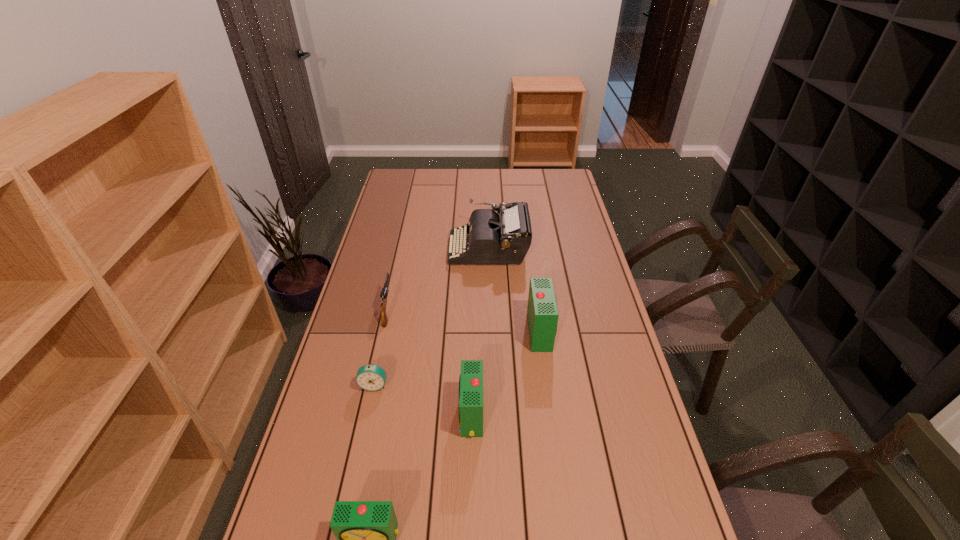
This screenshot has height=540, width=960. I want to click on the third shortest alarm clock, so click(471, 378).

Locate an element on the screen. Image resolution: width=960 pixels, height=540 pixels. the farthest alarm clock is located at coordinates (542, 313).

Find the location of a particular element. the shortest alarm clock is located at coordinates (371, 377).

Identify the location of typewriter. [x=504, y=237].

What are the coordinates of `gun` in the screenshot? It's located at (384, 292).

This screenshot has width=960, height=540. Find the location of `vacant space located 0.290m on the front-facing side of the second alarm clock from right to left`. vacant space located 0.290m on the front-facing side of the second alarm clock from right to left is located at coordinates click(356, 415).

You are a GUI agent. You are given a task and a screenshot of the screen. Output one action in this format:
    pyautogui.click(x=<x>, y=<y>)
    Task: Click on the vacant space located on the front-facing side of the second alarm clock from right to left
    The height and width of the screenshot is (540, 960).
    Given the screenshot: What is the action you would take?
    pyautogui.click(x=443, y=415)

Where is `vacant space located on the front-facing side of the second alarm clock from right to left`? The image size is (960, 540). vacant space located on the front-facing side of the second alarm clock from right to left is located at coordinates (331, 415).

Locate an element on the screen. The width and height of the screenshot is (960, 540). free space located 0.060m on the front-facing side of the rightmost alarm clock is located at coordinates (569, 332).

You are a GUI agent. You are given a task and a screenshot of the screen. Output one action in this format:
    pyautogui.click(x=<x>, y=<y>)
    Task: Click on the vacant point located on the front-facing side of the shortest alarm clock
    This screenshot has height=540, width=960.
    Given the screenshot: What is the action you would take?
    pyautogui.click(x=353, y=482)